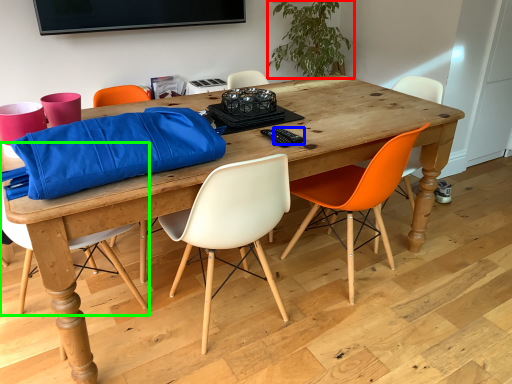
Question: Based on their relative distances, which object is nearer to houseplant (highlighted by a red box)? Choose from remote control (highlighted by a blue box) and chair (highlighted by a green box).

Choices:
 (A) remote control
 (B) chair

Answer: (A)